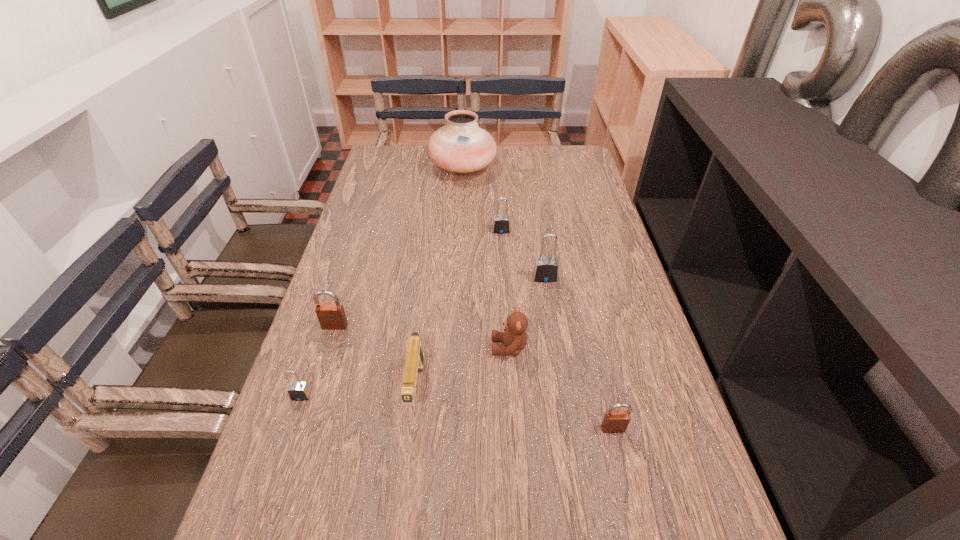
I want to click on vacant space located 0.220m on the face of the teddy bear, so click(x=397, y=347).

Identify the location of vacant position located at the barrel of the pistol. (398, 534).

Find the location of a particular element. Image resolution: width=960 pixels, height=540 pixels. free region located 0.230m on the shackle of the smallest gray padlock is located at coordinates (259, 520).

Find the location of a particular element. The width and height of the screenshot is (960, 540). vacant space located 0.180m on the front-facing side of the nearest padlock is located at coordinates (637, 534).

Find the location of a particular element. The width and height of the screenshot is (960, 540). object located in the far edge section of the desktop is located at coordinates (461, 146).

Where is `object at the right edge`? This screenshot has height=540, width=960. object at the right edge is located at coordinates (615, 421).

At what (x,y) coordinates should I click in order to perform the action: click on free region at the far edge. Please return your answer as a coordinate pair (x, y). The width and height of the screenshot is (960, 540). Looking at the image, I should click on click(x=497, y=173).

This screenshot has width=960, height=540. Find the location of `free space at the left edge`. free space at the left edge is located at coordinates (324, 386).

This screenshot has width=960, height=540. Find the location of `vacant space at the right edge`. vacant space at the right edge is located at coordinates (668, 421).

You are a GUI agent. You are given a task and a screenshot of the screen. Output one action in this format:
    pyautogui.click(x=<x>, y=<y>)
    Task: Click on the free space at the far left corner of the desktop
    
    Given the screenshot: What is the action you would take?
    pyautogui.click(x=395, y=163)